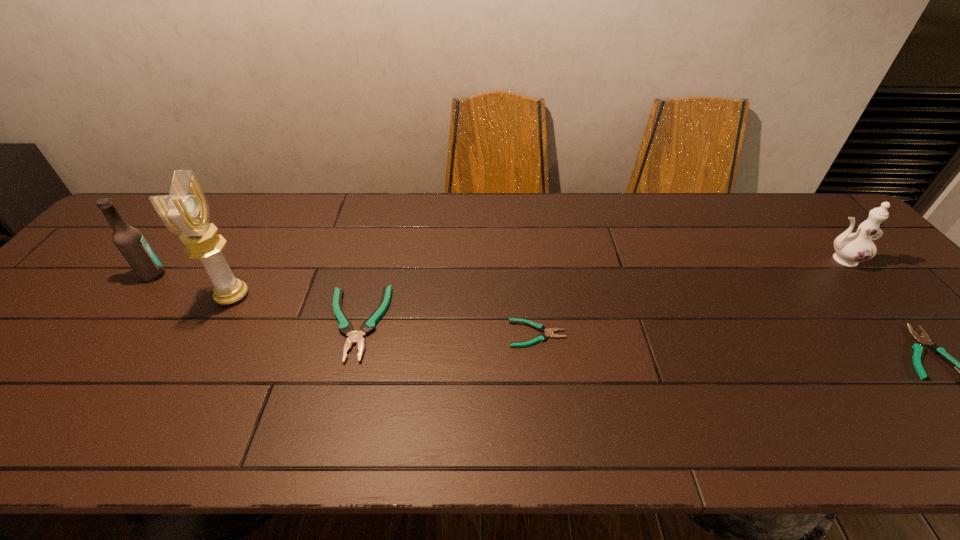
This screenshot has width=960, height=540. I want to click on free spot between the shortest object and the fifth object from right to left, so click(385, 315).

This screenshot has width=960, height=540. What are the coordinates of `free spot between the fourth object from right to left and the fifth object from right to left` in the screenshot? It's located at (295, 310).

This screenshot has width=960, height=540. I want to click on vacant area that lies between the chinaware and the shortest pliers, so click(x=689, y=296).

At what (x,y) coordinates should I click in order to perform the action: click on free space between the tallest pliers and the chinaware. Please return your answer as a coordinate pair (x, y). This screenshot has height=540, width=960. Looking at the image, I should click on (598, 292).

Locate an element on the screen. This screenshot has height=540, width=960. vacant area that lies between the fifth shortest object and the shortest pliers is located at coordinates (346, 305).

Where is `object that ranks as the second closest to the third tallest object`? This screenshot has height=540, width=960. object that ranks as the second closest to the third tallest object is located at coordinates click(x=540, y=327).

Find the location of a particular element. object that ranks as the third closest to the third object from right to left is located at coordinates (919, 348).

Find the location of a particular element. pliers that is the closest to the second pliers from left to right is located at coordinates (345, 326).

Point out which pliers is positioned as the third nearest to the second tallest object. Please provide its 2D coordinates. Your answer should be formatted as a tuple, i.e. [(x, y)], where the tuple contains the x and y coordinates of a point satisfying the conditions above.

[(919, 348)]

Identify the location of vacant position in the image that satisfies the following two spatial constraints: 1. on the front-facing side of the second object from left to right; 2. on the right side of the tallest pliers. (217, 323).